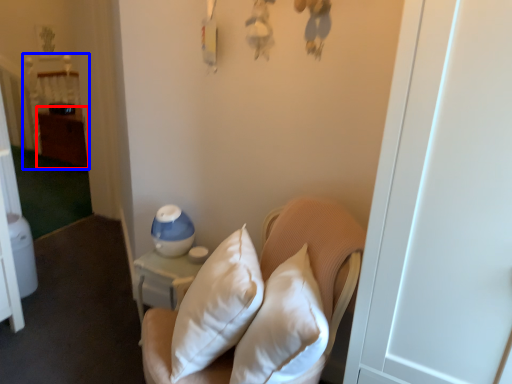
Question: Which object is further to the camera taking this photo, dresser (highlighted by a red box) or bed (highlighted by a blue box)?

Choices:
 (A) dresser
 (B) bed

Answer: (B)